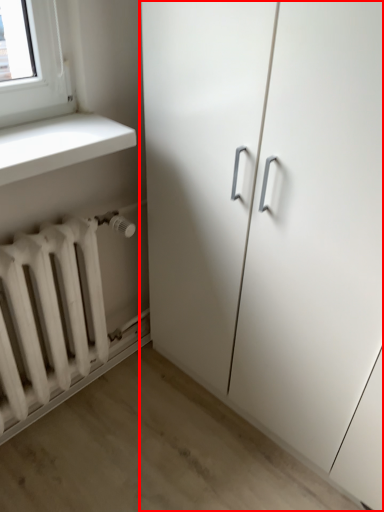
Question: Where is cupboard (annotated by the red box) located in relation to radiator in the image?

Choices:
 (A) left
 (B) right

Answer: (B)